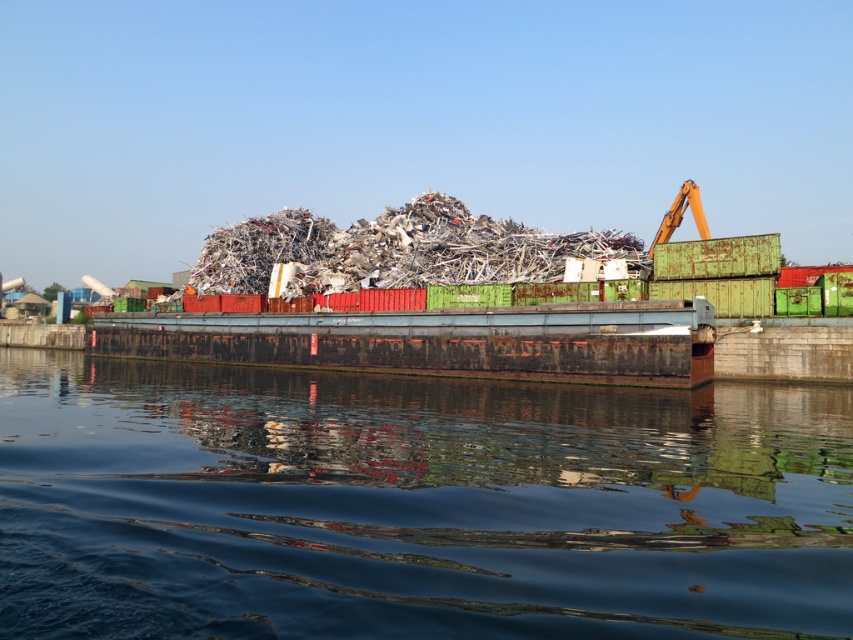
You are a waste management worker who needs to determine if there is enough space to place a new shipment of metallic debris. You observe the rusty metal barge at center and the shiny metallic debris at center. Which object takes up more space in the scene?

The shiny metallic debris at center occupies more space than the rusty metal barge at center, so the new shipment might not fit if the shiny metallic debris is already occupying most of the space.

You are a safety inspector checking the waterfront area. You see the transparent water at center and the shiny metallic debris at center. Which object is located to the left of the other?

The transparent water at center is positioned on the left side of shiny metallic debris at center.

You are a crane operator trying to lift the transparent water at center and the rusty metal barge at center. Which object is narrower so that it can fit through a narrow passage between two containers?

The transparent water at center is thinner than the rusty metal barge at center, so the transparent water at center can fit through the narrow passage between two containers.